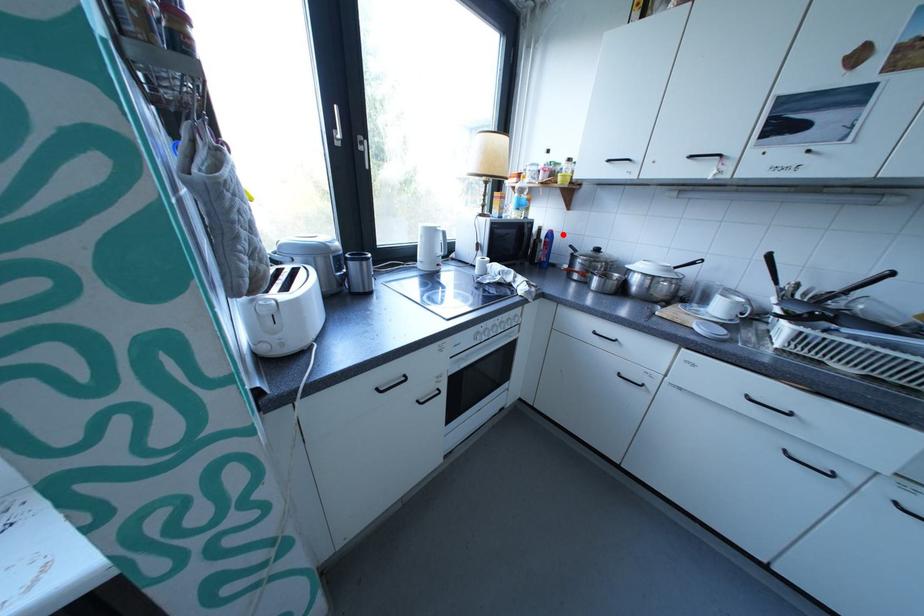
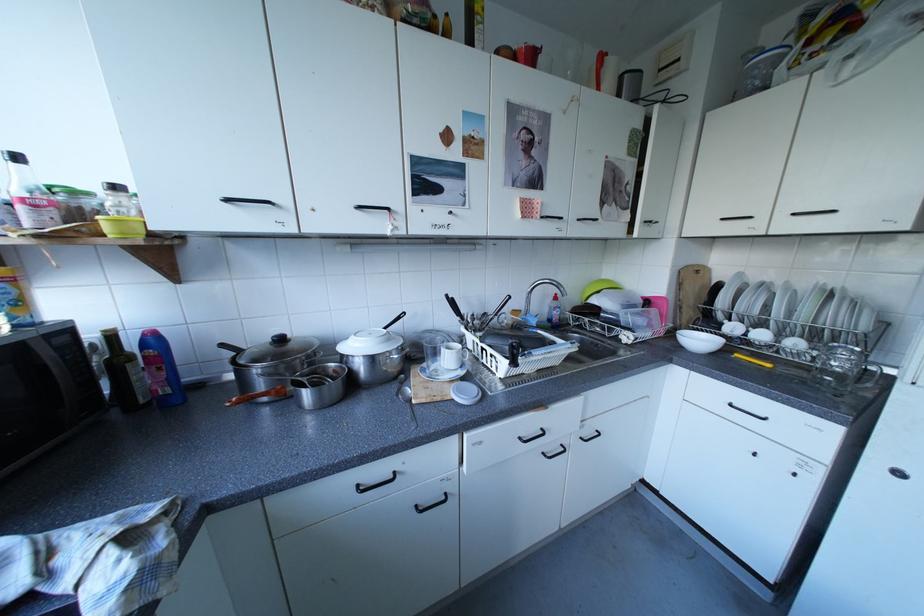
Question: I am providing you with two images of the same scene from different viewpoints. In image1, a red point is highlighted. Considering the same 3D point in image2, which of the following is correct?

Choices:
 (A) It is closer
 (B) It is farther

Answer: (B)